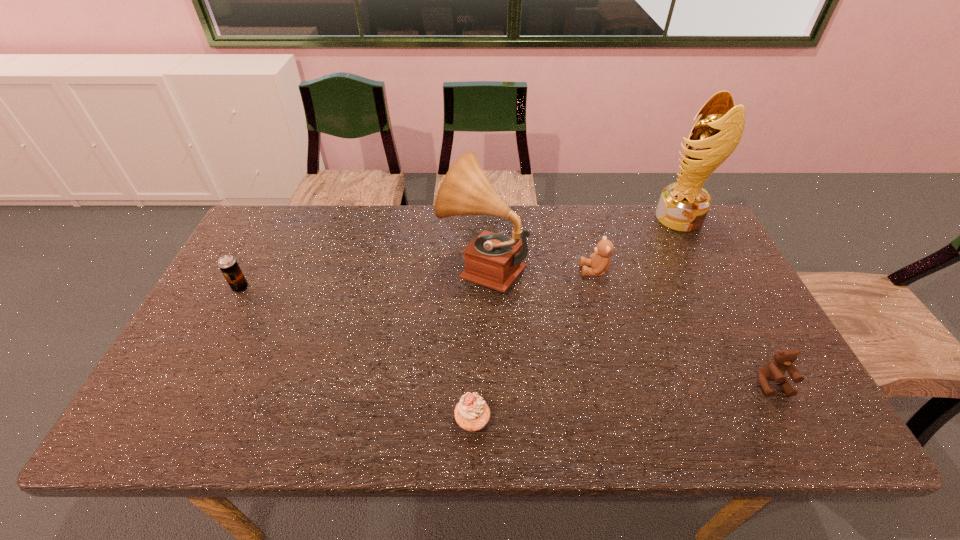
The height and width of the screenshot is (540, 960). What are the coordinates of `free space at the near edge of the desktop` in the screenshot? It's located at click(553, 427).

At what (x,y) coordinates should I click in order to perform the action: click on vacant space at the left edge of the desktop. Please return your answer as a coordinate pair (x, y). Looking at the image, I should click on (221, 361).

The image size is (960, 540). I want to click on free space at the right edge of the desktop, so click(742, 336).

In the image, there is a desktop. At what (x,y) coordinates should I click in order to perform the action: click on free space at the far left corner. Please return your answer as a coordinate pair (x, y). Looking at the image, I should click on (283, 249).

Find the location of a particular element. This screenshot has height=540, width=960. free space at the far right corner is located at coordinates (709, 248).

This screenshot has height=540, width=960. What are the coordinates of `free space between the leftmost object and the shortest object` in the screenshot? It's located at (356, 354).

Locate an element on the screen. free space between the phonograph record and the award is located at coordinates (581, 241).

Where is `vacant point located between the left teddy bear and the right teddy bear`? vacant point located between the left teddy bear and the right teddy bear is located at coordinates coord(684,327).

You are a GUI agent. You are given a task and a screenshot of the screen. Output one action in this format:
    pyautogui.click(x=<x>, y=<y>)
    Task: Click on the free space between the second nearest object and the tallest object
    
    Given the screenshot: What is the action you would take?
    pyautogui.click(x=726, y=301)

The width and height of the screenshot is (960, 540). Find the location of `free space between the phonograph record and the beer can`. free space between the phonograph record and the beer can is located at coordinates (362, 277).